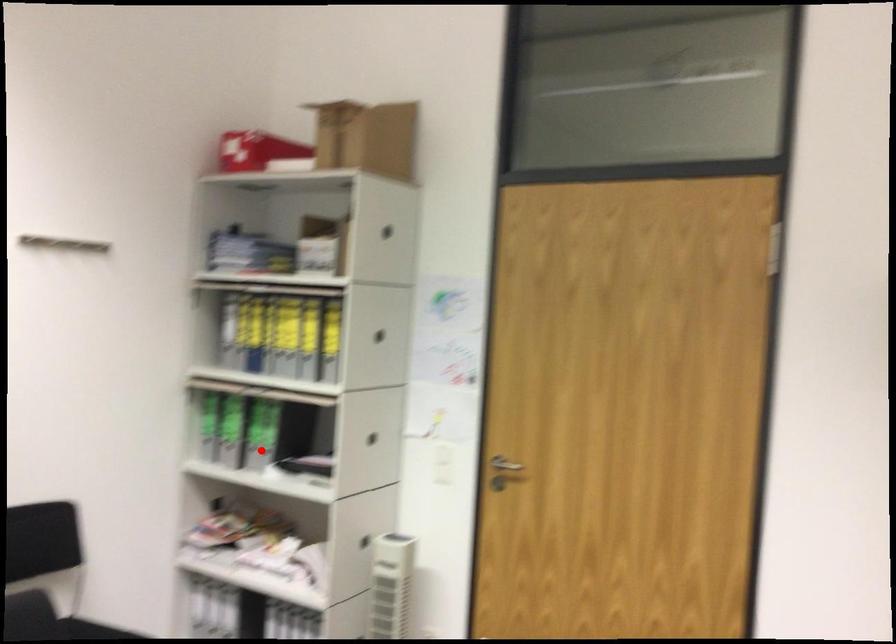
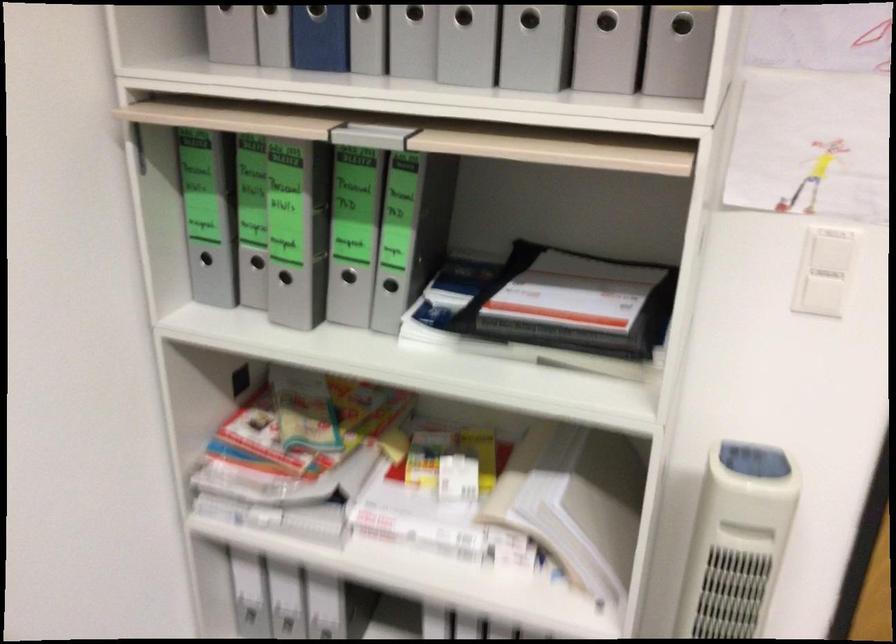
Locate, in the second image, the point that corresponds to the highlighted location in the first image.

(348, 276)